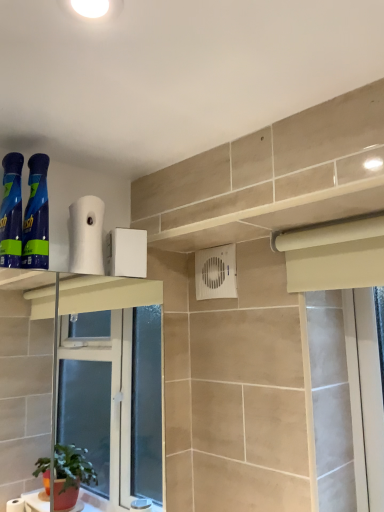
Question: Is blue glossy spray bottles at left, acting as the second cleaning product starting from the left, wider or thinner than white plastic air conditioning unit at center?

Choices:
 (A) wide
 (B) thin

Answer: (A)

Question: In terms of height, does blue glossy spray bottles at left, which ranks as the first cleaning product in right-to-left order, look taller or shorter compared to white plastic air conditioning unit at center?

Choices:
 (A) tall
 (B) short

Answer: (A)

Question: Which object is positioned closest to the blue glossy spray bottles at left, which ranks as the first cleaning product in right-to-left order?

Choices:
 (A) blue glossy spray can at left, placed as the first cleaning product when sorted from left to right
 (B) white matte toilet paper at upper center
 (C) white plastic air conditioning unit at center

Answer: (A)

Question: Which object is the closest to the white plastic air conditioning unit at center?

Choices:
 (A) blue glossy spray bottles at left, acting as the second cleaning product starting from the left
 (B) blue glossy spray can at left, placed as the first cleaning product when sorted from left to right
 (C) white matte toilet paper at upper center

Answer: (C)